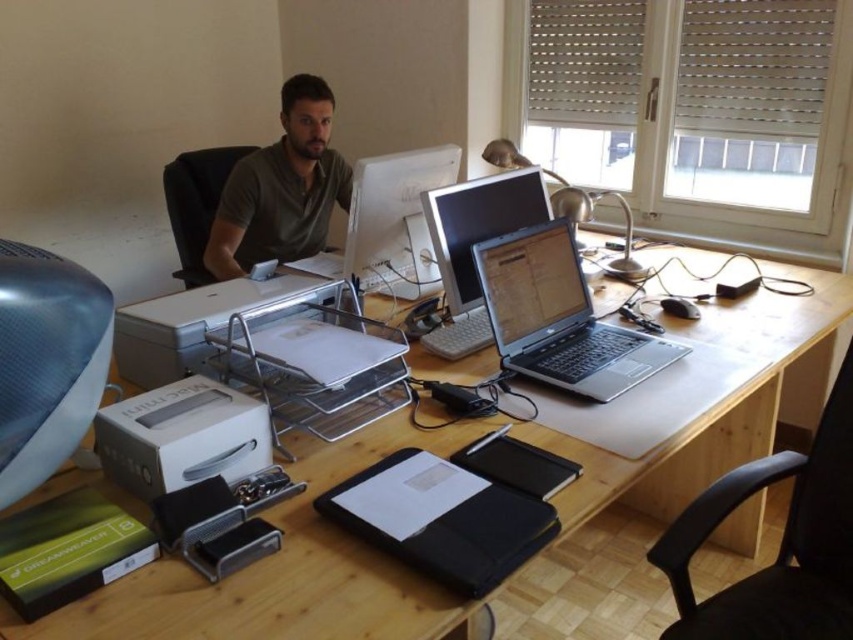
You are organizing the desk and need to place a new item between the green matte shirt at center and the matte white printer at center. Which object should you place the item closer to if you want it to be closer to the taller object?

The green matte shirt at center is taller than the matte white printer at center. Therefore, to place the item closer to the taller object, you should position it nearer to the green matte shirt at center.

You are standing in the room and want to place a new plant on the wooden desk at center. Based on the coordinates provided, where exactly should you place the plant?

The wooden desk at center is located at coordinates point (x=444, y=454), so place the plant there.